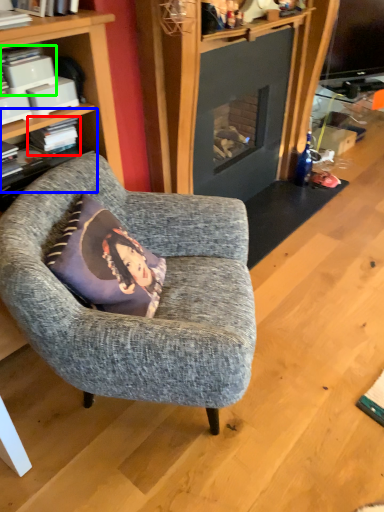
Question: Considering the real-world distances, which object is closest to book (highlighted by a red box)? shelf (highlighted by a blue box) or book (highlighted by a green box).

Choices:
 (A) shelf
 (B) book

Answer: (A)